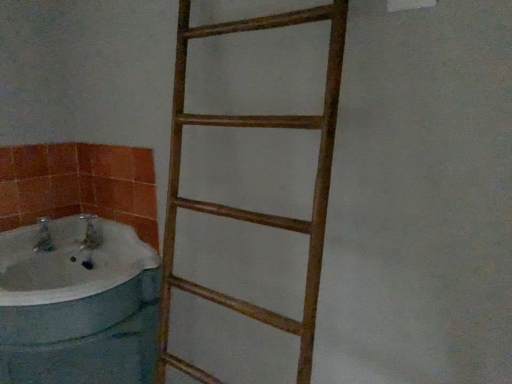
Describe the element at coordinates (247, 210) in the screenshot. I see `wooden ladder at center` at that location.

I want to click on wooden ladder at center, so click(247, 210).

Describe the element at coordinates (70, 281) in the screenshot. I see `white glossy bathtub at left` at that location.

What is the approximate height of white glossy bathtub at left?

white glossy bathtub at left is 8.39 inches tall.

Identify the location of white glossy bathtub at left. The image size is (512, 384). (70, 281).

In order to click on wooden ladder at center in this screenshot , I will do `click(247, 210)`.

Is white glossy bathtub at left at the left side of wooden ladder at center?

Yes, white glossy bathtub at left is to the left of wooden ladder at center.

Based on the photo, which is behind, white glossy bathtub at left or wooden ladder at center?

white glossy bathtub at left is further from the camera.

Is point (49, 296) closer or farther from the camera than point (179, 153)?

Point (49, 296) is farther from the camera than point (179, 153).

From the image's perspective, is white glossy bathtub at left on wooden ladder at center?

Actually, white glossy bathtub at left appears below wooden ladder at center in the image.

From a real-world perspective, is white glossy bathtub at left positioned over wooden ladder at center based on gravity?

No, from a real-world perspective, white glossy bathtub at left is not on top of wooden ladder at center.

Considering the sizes of objects white glossy bathtub at left and wooden ladder at center in the image provided, who is thinner, white glossy bathtub at left or wooden ladder at center?

Thinner between the two is wooden ladder at center.

In terms of height, does white glossy bathtub at left look taller or shorter compared to wooden ladder at center?

Clearly, white glossy bathtub at left is shorter compared to wooden ladder at center.

Does white glossy bathtub at left have a smaller size compared to wooden ladder at center?

Yes.

Is white glossy bathtub at left not within wooden ladder at center?

white glossy bathtub at left lies outside wooden ladder at center's area.

Is the surface of white glossy bathtub at left in direct contact with wooden ladder at center?

No, white glossy bathtub at left is not next to wooden ladder at center.

Is white glossy bathtub at left oriented towards wooden ladder at center?

No, white glossy bathtub at left is not facing towards wooden ladder at center.

The width and height of the screenshot is (512, 384). I want to click on ladder that is above the white glossy bathtub at left (from the image's perspective), so click(247, 210).

Based on the photo, between wooden ladder at center and white glossy bathtub at left, which one appears on the right side from the viewer's perspective?

From the viewer's perspective, wooden ladder at center appears more on the right side.

Between wooden ladder at center and white glossy bathtub at left, which one is positioned behind?

white glossy bathtub at left.

Between point (266, 16) and point (122, 288), which one is positioned in front?

The point (266, 16) is more forward.

From the image's perspective, is wooden ladder at center below white glossy bathtub at left?

Incorrect, from the image's perspective, wooden ladder at center is higher than white glossy bathtub at left.

From a real-world perspective, is wooden ladder at center below white glossy bathtub at left?

No, from a real-world perspective, wooden ladder at center is not below white glossy bathtub at left.

Which of these two, wooden ladder at center or white glossy bathtub at left, is wider?

white glossy bathtub at left is wider.

Considering the relative sizes of wooden ladder at center and white glossy bathtub at left in the image provided, is wooden ladder at center shorter than white glossy bathtub at left?

Incorrect, the height of wooden ladder at center does not fall short of that of white glossy bathtub at left.

Between wooden ladder at center and white glossy bathtub at left, which one has larger size?

With larger size is wooden ladder at center.

Can we say wooden ladder at center lies outside white glossy bathtub at left?

That's correct, wooden ladder at center is outside of white glossy bathtub at left.

Is wooden ladder at center beside white glossy bathtub at left?

No, wooden ladder at center is not making contact with white glossy bathtub at left.

Could you tell me if wooden ladder at center is turned towards white glossy bathtub at left?

No, wooden ladder at center is not aimed at white glossy bathtub at left.

How much distance is there between wooden ladder at center and white glossy bathtub at left?

wooden ladder at center and white glossy bathtub at left are 14.42 inches apart.

Where is `ladder above the white glossy bathtub at left (from the image's perspective)`? ladder above the white glossy bathtub at left (from the image's perspective) is located at coordinates (247, 210).

The width and height of the screenshot is (512, 384). I want to click on bathtub below the wooden ladder at center (from the image's perspective), so click(70, 281).

Identify the location of ladder in front of the white glossy bathtub at left. (247, 210).